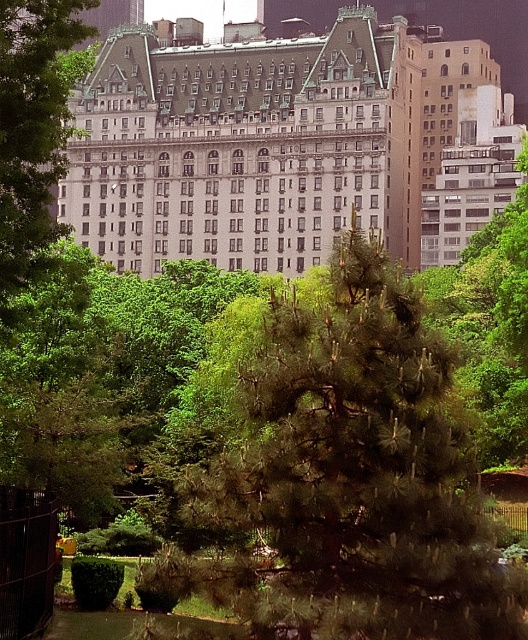
Which is behind, point (278, 241) or point (27, 12)?

Point (278, 241)

The height and width of the screenshot is (640, 528). Describe the element at coordinates (270, 140) in the screenshot. I see `white stone building at center` at that location.

At what (x,y) coordinates should I click in order to perform the action: click on white stone building at center. Please return your answer as a coordinate pair (x, y). Looking at the image, I should click on (270, 140).

Image resolution: width=528 pixels, height=640 pixels. I want to click on dark green pine tree at center, so click(344, 477).

Does point (426, 336) come in front of point (73, 218)?

That is True.

You are a GUI agent. You are given a task and a screenshot of the screen. Output one action in this format:
    pyautogui.click(x=<x>, y=<y>)
    Task: Click on the dark green pine tree at center
    Image resolution: width=528 pixels, height=640 pixels.
    Given the screenshot: What is the action you would take?
    pyautogui.click(x=344, y=477)

Does dark green pine tree at center have a greater width compared to green leafy tree at center?

Correct, the width of dark green pine tree at center exceeds that of green leafy tree at center.

The height and width of the screenshot is (640, 528). What do you see at coordinates (344, 477) in the screenshot?
I see `dark green pine tree at center` at bounding box center [344, 477].

Locate an element on the screen. The height and width of the screenshot is (640, 528). dark green pine tree at center is located at coordinates [344, 477].